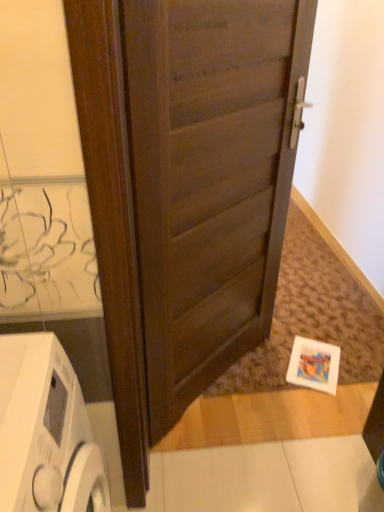
The image size is (384, 512). What do you see at coordinates (209, 179) in the screenshot?
I see `dark wood door at center` at bounding box center [209, 179].

This screenshot has height=512, width=384. What are the coordinates of `dark wood door at center` in the screenshot? It's located at (209, 179).

What do you see at coordinates (46, 432) in the screenshot? I see `white glossy washing machine at lower left` at bounding box center [46, 432].

Where is `white glossy washing machine at lower left`? The image size is (384, 512). white glossy washing machine at lower left is located at coordinates (46, 432).

Find the location of a particular element. The height and width of the screenshot is (512, 384). dark wood door at center is located at coordinates (209, 179).

Between white glossy washing machine at lower left and dark wood door at center, which one appears on the left side from the viewer's perspective?

white glossy washing machine at lower left.

Based on the photo, considering their positions, is white glossy washing machine at lower left located in front of or behind dark wood door at center?

white glossy washing machine at lower left is positioned closer to the viewer than dark wood door at center.

Which is closer to the camera, (x=66, y=479) or (x=179, y=91)?

Point (x=66, y=479) appears to be closer to the viewer than point (x=179, y=91).

From the image's perspective, which is below, white glossy washing machine at lower left or dark wood door at center?

white glossy washing machine at lower left is shown below in the image.

From a real-world perspective, is white glossy washing machine at lower left below dark wood door at center?

Correct, in the physical world, white glossy washing machine at lower left is lower than dark wood door at center.

Consider the image. Considering the relative sizes of white glossy washing machine at lower left and dark wood door at center in the image provided, is white glossy washing machine at lower left wider than dark wood door at center?

A: Correct, the width of white glossy washing machine at lower left exceeds that of dark wood door at center.

Can you confirm if white glossy washing machine at lower left is shorter than dark wood door at center?

Yes.

In terms of size, does white glossy washing machine at lower left appear bigger or smaller than dark wood door at center?

white glossy washing machine at lower left is smaller than dark wood door at center.

Looking at this image, is white glossy washing machine at lower left situated inside dark wood door at center or outside?

white glossy washing machine at lower left cannot be found inside dark wood door at center.

Is white glossy washing machine at lower left placed right next to dark wood door at center?

white glossy washing machine at lower left and dark wood door at center are clearly separated.

Is white glossy washing machine at lower left turned away from dark wood door at center?

No, white glossy washing machine at lower left is not facing the opposite direction of dark wood door at center.

Based on the photo, how much distance is there between white glossy washing machine at lower left and dark wood door at center?

white glossy washing machine at lower left and dark wood door at center are 26.52 inches apart.

At what (x,y) coordinates should I click in order to perform the action: click on home appliance located below the dark wood door at center (from the image's perspective). Please return your answer as a coordinate pair (x, y). This screenshot has width=384, height=512. Looking at the image, I should click on (46, 432).

In the image, is dark wood door at center on the left side or the right side of white glossy washing machine at lower left?

dark wood door at center is positioned on white glossy washing machine at lower left's right side.

In the image, is dark wood door at center positioned in front of or behind white glossy washing machine at lower left?

In the image, dark wood door at center appears behind white glossy washing machine at lower left.

Considering the positions of point (170, 80) and point (105, 500), is point (170, 80) closer or farther from the camera than point (105, 500)?

Clearly, point (170, 80) is more distant from the camera than point (105, 500).

From the image's perspective, which one is positioned higher, dark wood door at center or white glossy washing machine at lower left?

From the image's view, dark wood door at center is above.

From a real-world perspective, who is located higher, dark wood door at center or white glossy washing machine at lower left?

dark wood door at center is physically above.

Considering the relative sizes of dark wood door at center and white glossy washing machine at lower left in the image provided, is dark wood door at center thinner than white glossy washing machine at lower left?

Indeed, dark wood door at center has a lesser width compared to white glossy washing machine at lower left.

Between dark wood door at center and white glossy washing machine at lower left, which one has less height?

white glossy washing machine at lower left.

Is dark wood door at center bigger or smaller than white glossy washing machine at lower left?

dark wood door at center is bigger than white glossy washing machine at lower left.

Which is correct: dark wood door at center is inside white glossy washing machine at lower left, or outside of it?

The correct answer is: outside.

Is dark wood door at center directly adjacent to white glossy washing machine at lower left?

No, dark wood door at center is not touching white glossy washing machine at lower left.

Is dark wood door at center aimed at white glossy washing machine at lower left?

No, dark wood door at center is not aimed at white glossy washing machine at lower left.

How different are the orientations of dark wood door at center and white glossy washing machine at lower left in degrees?

dark wood door at center and white glossy washing machine at lower left are facing 43.6 degrees away from each other.

I want to click on home appliance lying below the dark wood door at center (from the image's perspective), so click(x=46, y=432).

In order to click on door lying on the right of white glossy washing machine at lower left in this screenshot , I will do `click(209, 179)`.

Find the location of a particular element. This screenshot has height=512, width=384. door behind the white glossy washing machine at lower left is located at coordinates (209, 179).